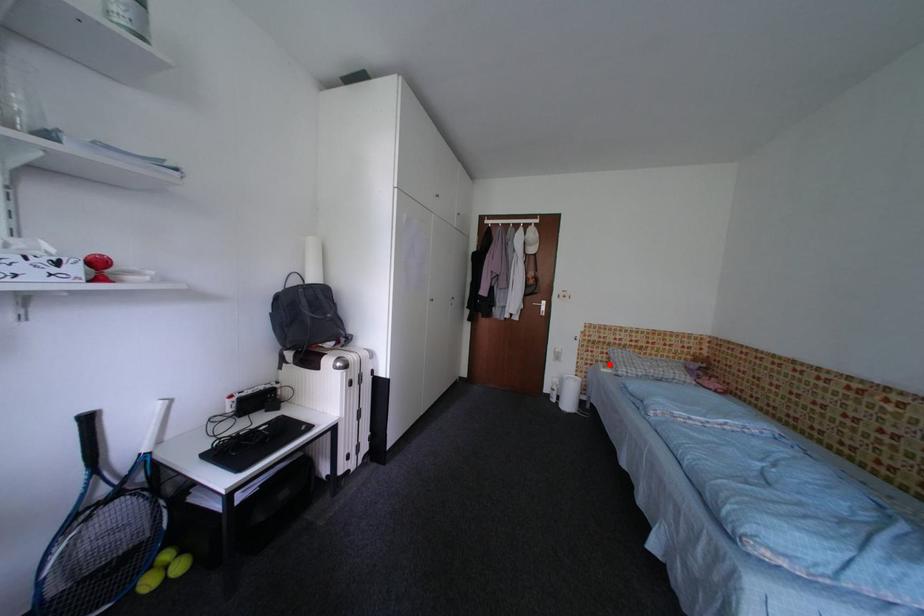
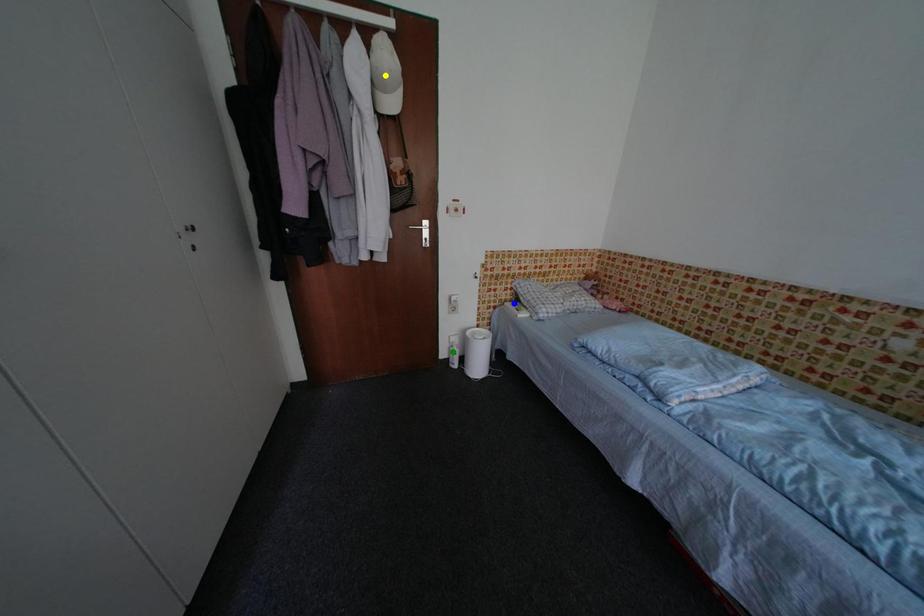
Question: I am providing you with two images of the same scene from different viewpoints. A red point is marked on the first image. You are given multiple points on the second image. Can you choose the point in image 2 that corresponds to the point in image 1?

Choices:
 (A) green point
 (B) yellow point
 (C) blue point

Answer: (C)